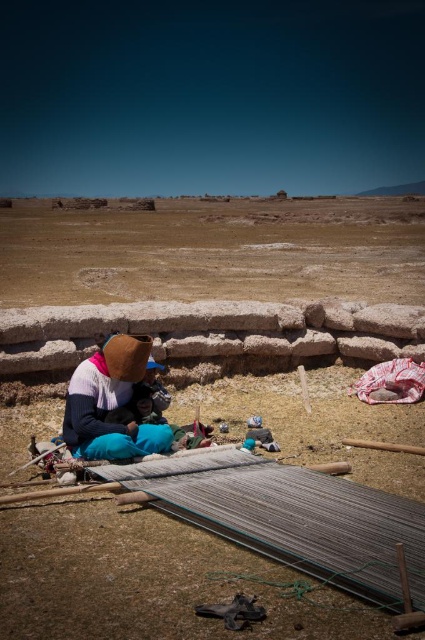
You are a photographer standing in the desert and want to take a photo of the brown dry soil at center and the brown woolen hat at center. Which object should you focus on first if you want to capture both in sharp focus?

The brown woolen hat at center is closer to you than the brown dry soil at center, so you should focus on the brown woolen hat at center first to ensure both are in sharp focus.

You are a photographer planning to capture the weaver and their tools. You want to ensure the brown dry soil at center and the brown woolen hat at center are both in focus. Which object should you adjust your camera focus on first to account for their sizes?

The brown dry soil at center is wider than the brown woolen hat at center. Therefore, you should focus on the brown dry soil at center first since it covers a larger area, ensuring both objects remain in focus.

You are a photographer standing at the camera position. You want to capture a closeup shot of the brown dry soil at center. Given that your camera has a minimum focusing distance of 2 meters, will you be able to take the photo without moving closer?

The brown dry soil at center is 30.73 meters away from the camera. Since your camera can focus as close as 2 meters, you are more than 2 meters away, so yes, you can take the closeup shot without moving closer.